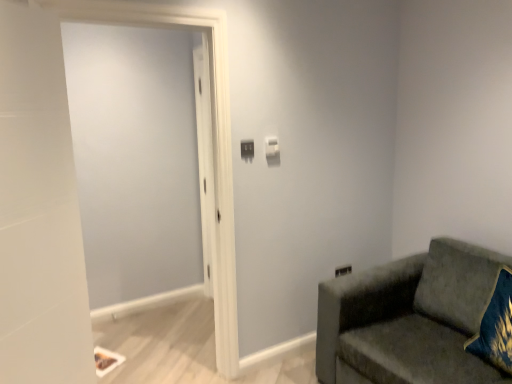
Question: Does white glossy door at left appear on the left side of matte plastic light switch at center, which ranks as the second light switch in back-to-front order?

Choices:
 (A) no
 (B) yes

Answer: (B)

Question: Does white glossy door at left have a lesser height compared to matte plastic light switch at center, arranged as the 2th light switch when viewed from the right?

Choices:
 (A) yes
 (B) no

Answer: (B)

Question: Is white glossy door at left aimed at matte plastic light switch at center, arranged as the 2th light switch when viewed from the right?

Choices:
 (A) no
 (B) yes

Answer: (A)

Question: Is white glossy door at left further to camera compared to matte plastic light switch at center, arranged as the 2th light switch when viewed from the right?

Choices:
 (A) no
 (B) yes

Answer: (A)

Question: Is white glossy door at left wider than matte plastic light switch at center, which ranks as the second light switch in back-to-front order?

Choices:
 (A) yes
 (B) no

Answer: (A)

Question: Is white glossy door at left taller than matte plastic light switch at center, which appears as the first light switch when viewed from the front?

Choices:
 (A) yes
 (B) no

Answer: (A)

Question: Is matte plastic light switch at center, arranged as the 2th light switch when viewed from the right, positioned in front of white plastic light switch at upper center, the 1th light switch positioned from the back?

Choices:
 (A) yes
 (B) no

Answer: (A)

Question: Does matte plastic light switch at center, arranged as the 2th light switch when viewed from the right, have a greater width compared to white plastic light switch at upper center, the second light switch from the front?

Choices:
 (A) yes
 (B) no

Answer: (B)

Question: Is matte plastic light switch at center, which ranks as the second light switch in back-to-front order, positioned with its back to white plastic light switch at upper center, the 2th light switch when ordered from left to right?

Choices:
 (A) no
 (B) yes

Answer: (A)

Question: From a real-world perspective, does matte plastic light switch at center, acting as the 1th light switch starting from the left, stand above white plastic light switch at upper center, the 1th light switch positioned from the right?

Choices:
 (A) no
 (B) yes

Answer: (A)

Question: Considering the relative positions of matte plastic light switch at center, which ranks as the second light switch in back-to-front order, and white plastic light switch at upper center, the second light switch from the front, in the image provided, is matte plastic light switch at center, which ranks as the second light switch in back-to-front order, to the right of white plastic light switch at upper center, the second light switch from the front, from the viewer's perspective?

Choices:
 (A) yes
 (B) no

Answer: (B)

Question: Is matte plastic light switch at center, acting as the 1th light switch starting from the left, not within white plastic light switch at upper center, the 1th light switch positioned from the back?

Choices:
 (A) no
 (B) yes

Answer: (B)

Question: Is velvet green couch at right oriented away from matte plastic light switch at center, which ranks as the second light switch in back-to-front order?

Choices:
 (A) no
 (B) yes

Answer: (A)